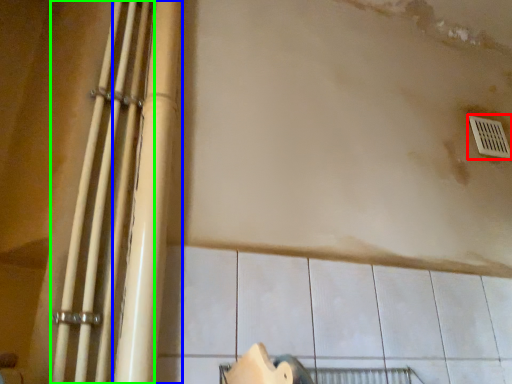
Question: Which object is positioned farthest from window (highlighted by a red box)? Select from beam (highlighted by a blue box) and beam (highlighted by a green box).

Choices:
 (A) beam
 (B) beam

Answer: (B)